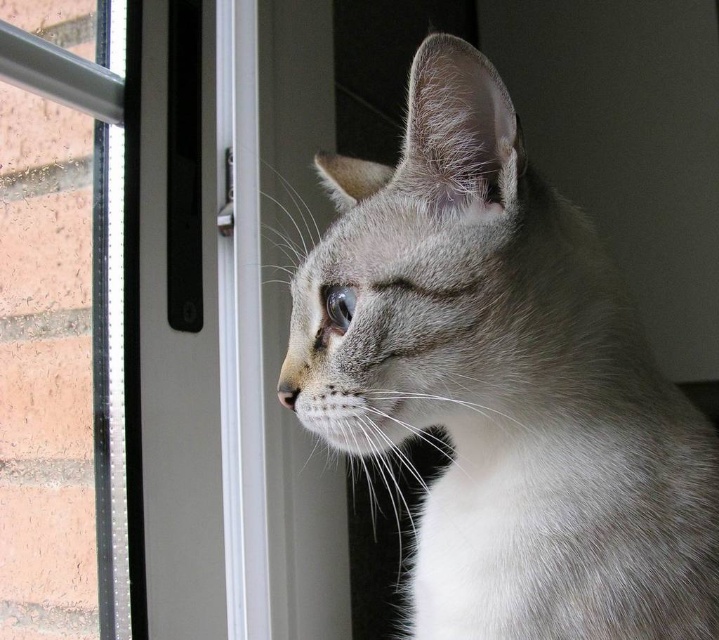
You are standing in front of the window where the cat is looking out. There are two points marked on the window glass, one at coordinates point (626, 376) and the other at point (170, 90). Which point is closer to you?

Point (626, 376) is closer to the viewer than point (170, 90).

You are a cat owner who wants to ensure your cat can see outside through the window. Based on the image, is the gray fur cat at center positioned in a way that allows it to have an unobstructed view through the clear plastic screen door at center?

The gray fur cat at center is closer to the viewer than the clear plastic screen door at center, so the cat would have an unobstructed view through the clear plastic screen door at center as it is positioned in front of it.